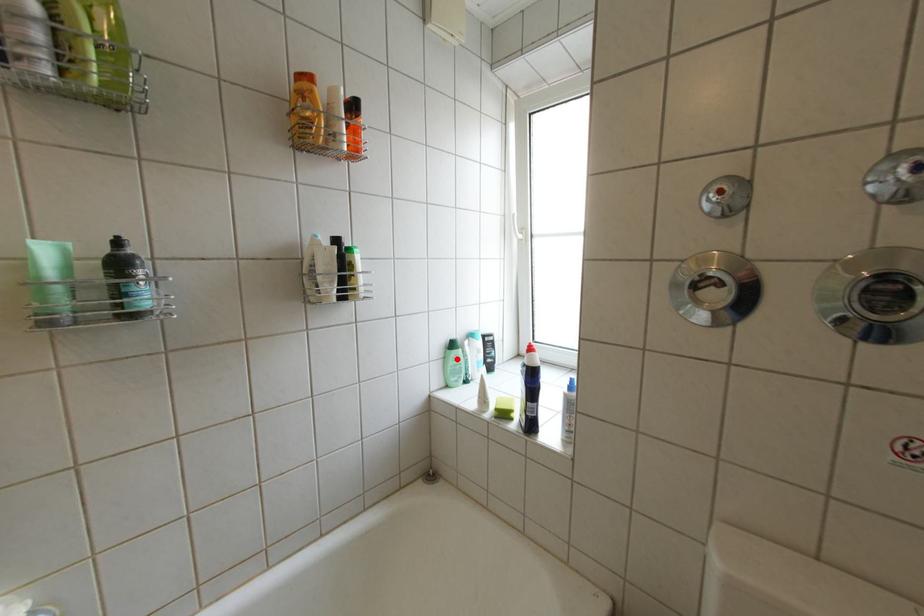
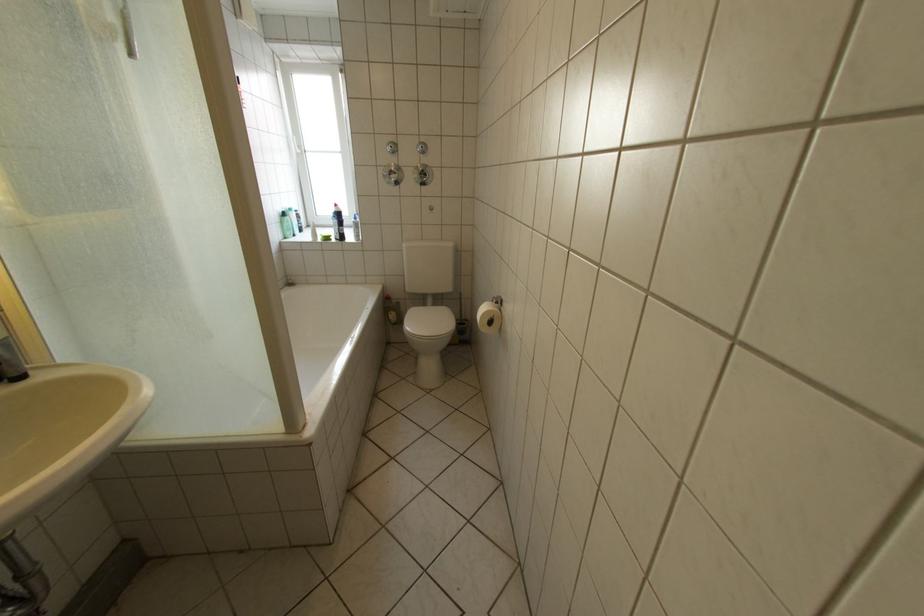
Find the pixel in the second image that matches the highlighted location in the first image.

(294, 224)